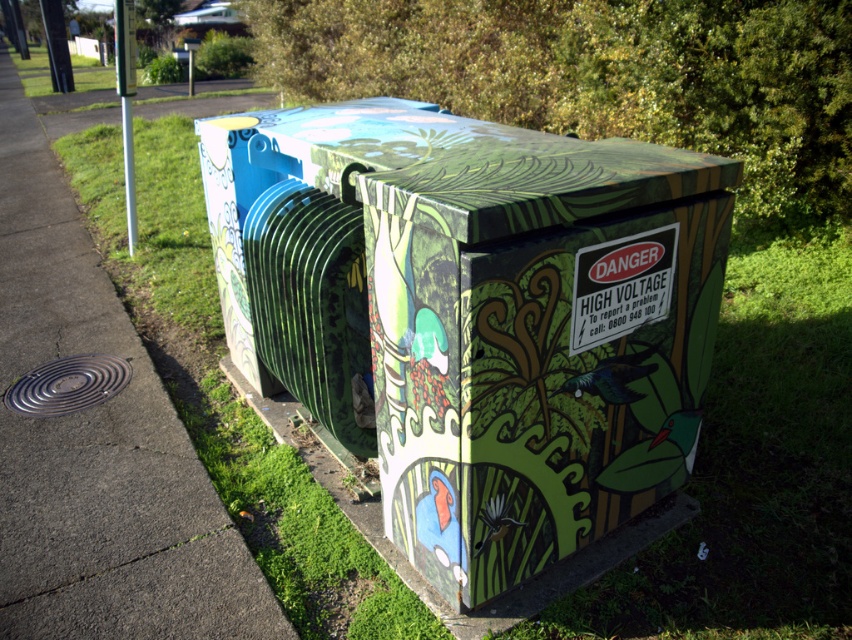
Question: Among these points, which one is farthest from the camera?

Choices:
 (A) (394, 276)
 (B) (33, 291)

Answer: (B)

Question: Is matte green painted box at center above concrete sidewalk at lower left?

Choices:
 (A) no
 (B) yes

Answer: (A)

Question: Considering the relative positions of matte green painted box at center and concrete sidewalk at lower left in the image provided, where is matte green painted box at center located with respect to concrete sidewalk at lower left?

Choices:
 (A) above
 (B) below

Answer: (B)

Question: Among these objects, which one is nearest to the camera?

Choices:
 (A) matte green painted box at center
 (B) concrete sidewalk at lower left

Answer: (A)

Question: Does matte green painted box at center have a smaller size compared to concrete sidewalk at lower left?

Choices:
 (A) yes
 (B) no

Answer: (A)